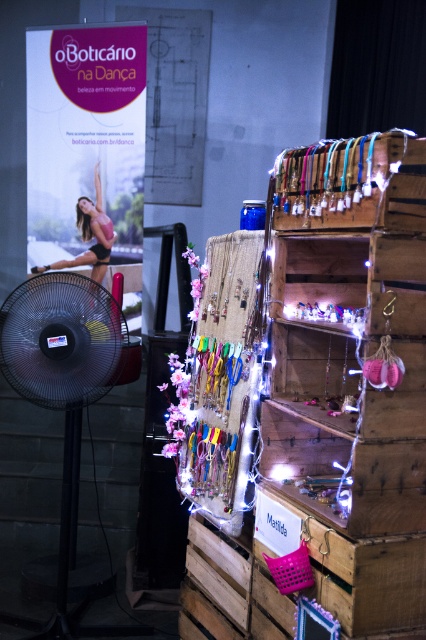
Question: Is black plastic mechanical fan at left below matte black bikini at center?

Choices:
 (A) no
 (B) yes

Answer: (B)

Question: Which object appears farthest from the camera in this image?

Choices:
 (A) black plastic mechanical fan at left
 (B) matte black bikini at center

Answer: (B)

Question: Which object appears closest to the camera in this image?

Choices:
 (A) black plastic mechanical fan at left
 (B) matte black bikini at center

Answer: (A)

Question: Considering the relative positions of black plastic mechanical fan at left and matte black bikini at center in the image provided, where is black plastic mechanical fan at left located with respect to matte black bikini at center?

Choices:
 (A) below
 (B) above

Answer: (A)

Question: Does black plastic mechanical fan at left have a larger size compared to matte black bikini at center?

Choices:
 (A) yes
 (B) no

Answer: (A)